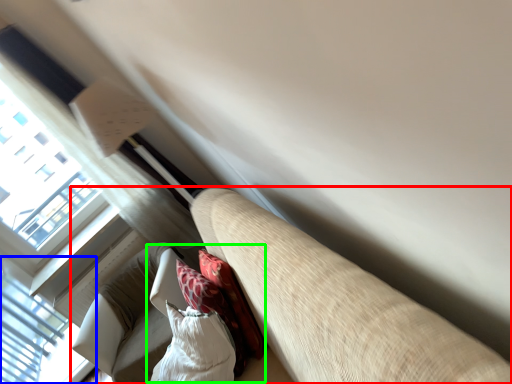
Question: Based on their relative distances, which object is farther from studio couch (highlighted by a red box)? Choose from window (highlighted by a blue box) and bean bag chair (highlighted by a green box).

Choices:
 (A) window
 (B) bean bag chair

Answer: (A)